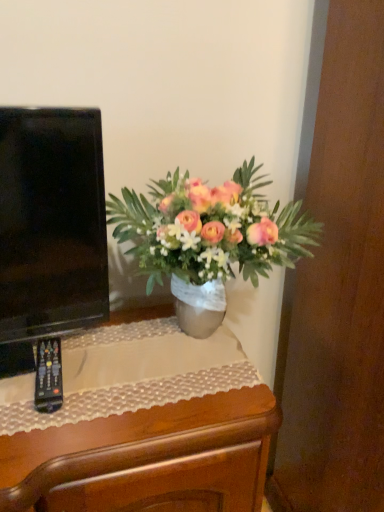
The height and width of the screenshot is (512, 384). I want to click on free spot in front of black plastic remote at lower left, so click(x=41, y=430).